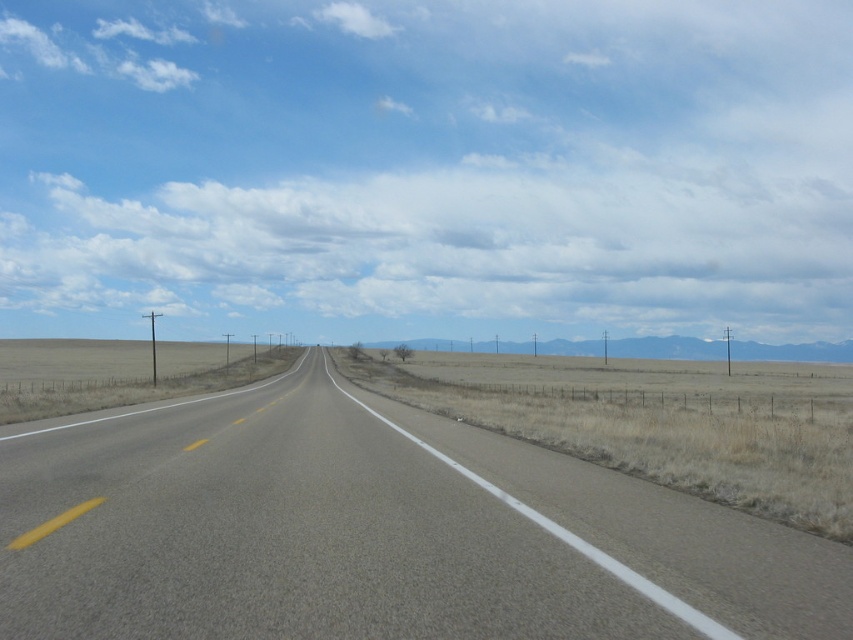
Question: Is asphalt road at center bigger than dry grass at center?

Choices:
 (A) yes
 (B) no

Answer: (B)

Question: Among these points, which one is farthest from the camera?

Choices:
 (A) (628, 401)
 (B) (97, 563)

Answer: (A)

Question: Is asphalt road at center bigger than dry grass at center?

Choices:
 (A) no
 (B) yes

Answer: (A)

Question: Which point is closer to the camera?

Choices:
 (A) (843, 456)
 (B) (109, 595)

Answer: (B)

Question: Is the position of asphalt road at center more distant than that of dry grass at center?

Choices:
 (A) yes
 (B) no

Answer: (B)